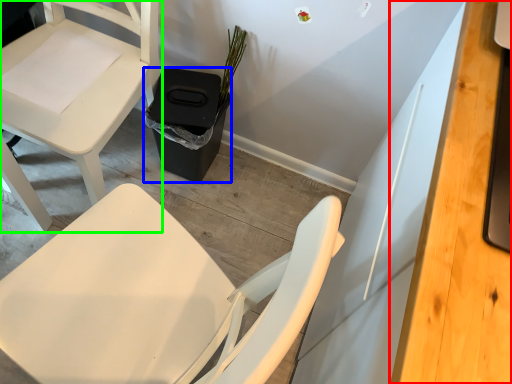
Question: Considering the real-world distances, which object is farthest from desk (highlighted by a red box)? trash bin/can (highlighted by a blue box) or chair (highlighted by a green box)?

Choices:
 (A) trash bin/can
 (B) chair

Answer: (B)